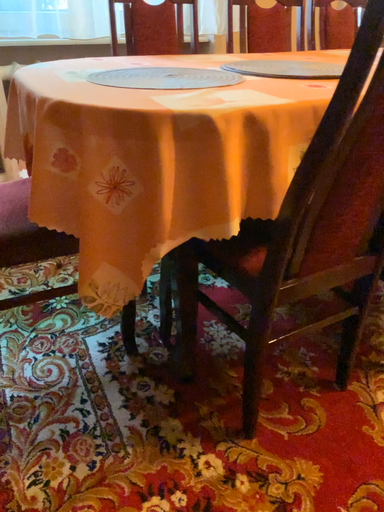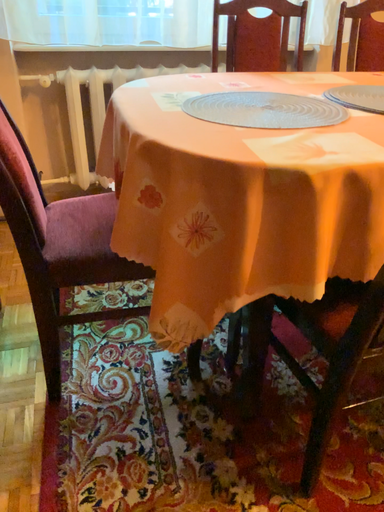
Question: How did the camera likely rotate when shooting the video?

Choices:
 (A) rotated left
 (B) rotated right

Answer: (A)